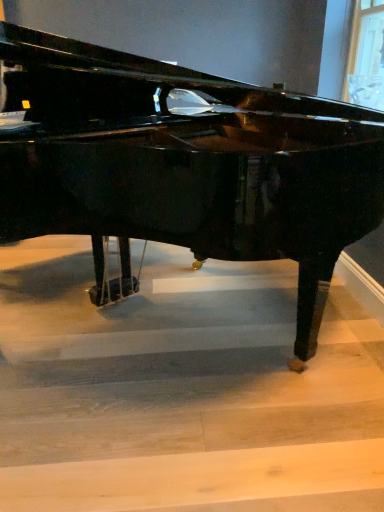
The image size is (384, 512). I want to click on wooden stairwell at center, so click(182, 389).

This screenshot has height=512, width=384. What do you see at coordinates (182, 389) in the screenshot?
I see `wooden stairwell at center` at bounding box center [182, 389].

This screenshot has height=512, width=384. Find the location of `glossy black piano at center`. glossy black piano at center is located at coordinates (184, 165).

This screenshot has width=384, height=512. What do you see at coordinates (184, 165) in the screenshot? I see `glossy black piano at center` at bounding box center [184, 165].

The height and width of the screenshot is (512, 384). What are the coordinates of `wooden stairwell at center` in the screenshot? It's located at click(182, 389).

Does glossy black piano at center appear on the right side of wooden stairwell at center?

No.

Which is behind, glossy black piano at center or wooden stairwell at center?

wooden stairwell at center is more distant.

Is point (221, 188) positioned behind point (20, 247)?

No.

From the image's perspective, is glossy black piano at center located above wooden stairwell at center?

Yes.

From a real-world perspective, is glossy black piano at center on wooden stairwell at center?

Yes, from a real-world perspective, glossy black piano at center is over wooden stairwell at center

Between glossy black piano at center and wooden stairwell at center, which one has smaller width?

glossy black piano at center.

Considering the sizes of glossy black piano at center and wooden stairwell at center in the image, is glossy black piano at center taller or shorter than wooden stairwell at center?

Considering their sizes, glossy black piano at center has more height than wooden stairwell at center.

Can you confirm if glossy black piano at center is smaller than wooden stairwell at center?

Incorrect, glossy black piano at center is not smaller in size than wooden stairwell at center.

Is glossy black piano at center situated inside wooden stairwell at center or outside?

glossy black piano at center is not enclosed by wooden stairwell at center.

Is glossy black piano at center not near wooden stairwell at center?

They are positioned close to each other.

Is glossy black piano at center facing away from wooden stairwell at center?

glossy black piano at center is not turned away from wooden stairwell at center.

Measure the distance between glossy black piano at center and wooden stairwell at center.

They are 24.94 inches apart.

Where is `piano above the wooden stairwell at center (from a real-world perspective)`? The image size is (384, 512). piano above the wooden stairwell at center (from a real-world perspective) is located at coordinates (184, 165).

Between wooden stairwell at center and glossy black piano at center, which one appears on the left side from the viewer's perspective?

glossy black piano at center.

Is the depth of wooden stairwell at center less than that of glossy black piano at center?

That is False.

Is point (89, 450) closer to camera compared to point (94, 144)?

Yes.

From the image's perspective, which object appears higher, wooden stairwell at center or glossy black piano at center?

glossy black piano at center.

Consider the image. From a real-world perspective, is wooden stairwell at center under glossy black piano at center?

Yes.

Considering the sizes of wooden stairwell at center and glossy black piano at center in the image, is wooden stairwell at center wider or thinner than glossy black piano at center?

In the image, wooden stairwell at center appears to be wider than glossy black piano at center.

Considering the sizes of objects wooden stairwell at center and glossy black piano at center in the image provided, who is shorter, wooden stairwell at center or glossy black piano at center?

With less height is wooden stairwell at center.

Does wooden stairwell at center have a larger size compared to glossy black piano at center?

Incorrect, wooden stairwell at center is not larger than glossy black piano at center.

Which is correct: wooden stairwell at center is inside glossy black piano at center, or outside of it?

wooden stairwell at center cannot be found inside glossy black piano at center.

Is wooden stairwell at center beside glossy black piano at center?

wooden stairwell at center and glossy black piano at center are clearly separated.

Is wooden stairwell at center turned away from glossy black piano at center?

No.

How distant is wooden stairwell at center from glossy black piano at center?

They are 24.94 inches apart.

There is a wooden stairwell at center. Where is `piano above it (from a real-world perspective)`? piano above it (from a real-world perspective) is located at coordinates (184, 165).

The width and height of the screenshot is (384, 512). Find the location of `stairwell below the glossy black piano at center (from the image's perspective)`. stairwell below the glossy black piano at center (from the image's perspective) is located at coordinates (182, 389).

Where is `stairwell behind the glossy black piano at center`? stairwell behind the glossy black piano at center is located at coordinates (182, 389).